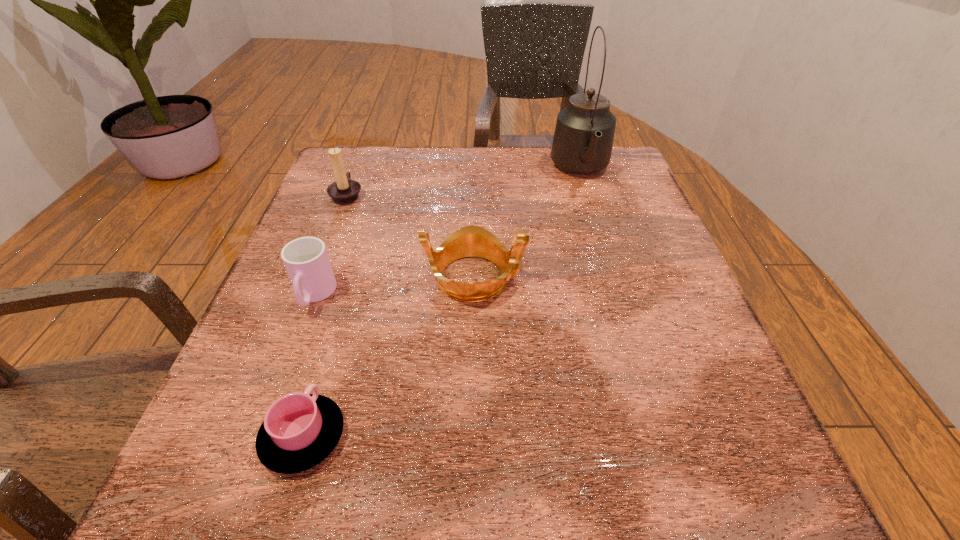
Locate which object ranks second in proximity to the second shortest object. Please provide its 2D coordinates. Your answer should be formatted as a tuple, i.e. [(x, y)], where the tuple contains the x and y coordinates of a point satisfying the conditions above.

[(300, 430)]

Where is `free space that satisfies the following two spatial constraints: 1. at the front emblem of the fourth object from left to right; 2. with the handle on the side of the taller cup`? free space that satisfies the following two spatial constraints: 1. at the front emblem of the fourth object from left to right; 2. with the handle on the side of the taller cup is located at coordinates (474, 295).

What are the coordinates of `free space that satisfies the following two spatial constraints: 1. on the side with the handle of the nearer cup; 2. on the wick of the candle holder` in the screenshot? It's located at pyautogui.click(x=376, y=194).

Identify the location of free space in the image that satisfies the following two spatial constraints: 1. on the wick of the candle holder; 2. on the side with the handle of the nearest object. pyautogui.click(x=253, y=436).